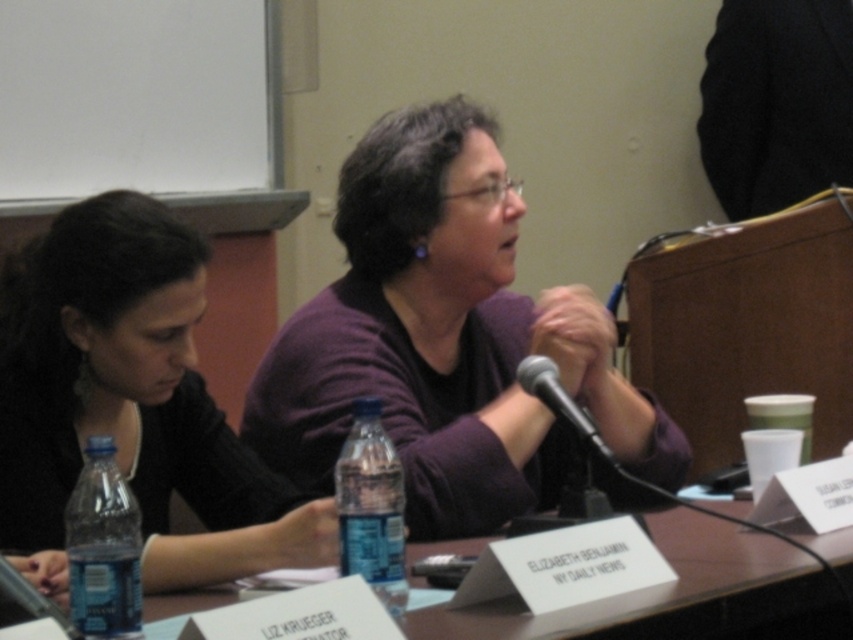
Question: Is clear plastic water bottle at lower left bigger than blue plastic bottle at lower left?

Choices:
 (A) yes
 (B) no

Answer: (A)

Question: Among these points, which one is nearest to the camera?

Choices:
 (A) (99, 474)
 (B) (556, 374)
 (C) (297, 388)

Answer: (A)

Question: Which point appears farthest from the camera in this image?

Choices:
 (A) (386, 538)
 (B) (486, 380)

Answer: (B)

Question: Is purple matte sweater at center above black matte shirt at left?

Choices:
 (A) yes
 (B) no

Answer: (A)

Question: Which point is closer to the camera taking this photo?

Choices:
 (A) (x=555, y=627)
 (B) (x=108, y=516)

Answer: (A)

Question: Does black matte shirt at left have a greater width compared to clear plastic water bottle at lower left?

Choices:
 (A) no
 (B) yes

Answer: (A)